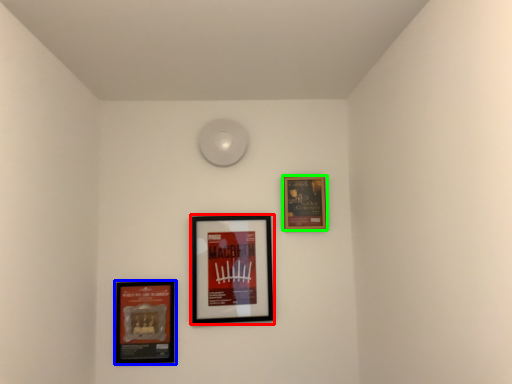
Question: Based on their relative distances, which object is nearer to picture frame (highlighted by a red box)? Choose from picture frame (highlighted by a blue box) and picture frame (highlighted by a green box).

Choices:
 (A) picture frame
 (B) picture frame

Answer: (A)